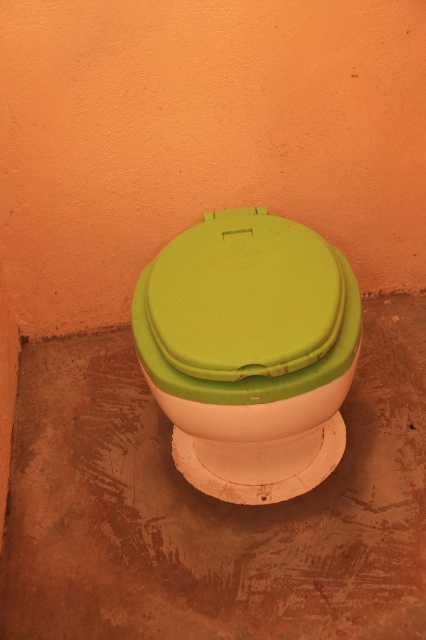
You are a maintenance worker inspecting the toilet. You need to determine which part is shorter between the green matte toilet lid at center and the green matte toilet bowl at center. Which one is shorter?

The green matte toilet lid at center has a lesser height compared to the green matte toilet bowl at center, so the green matte toilet lid at center is shorter.

You are a bathroom designer planning to install a new toilet. You have a limited space in the bathroom. Which object between the green matte toilet lid at center and the green matte toilet bowl at center takes up more space?

The green matte toilet bowl at center takes up more space than the green matte toilet lid at center.